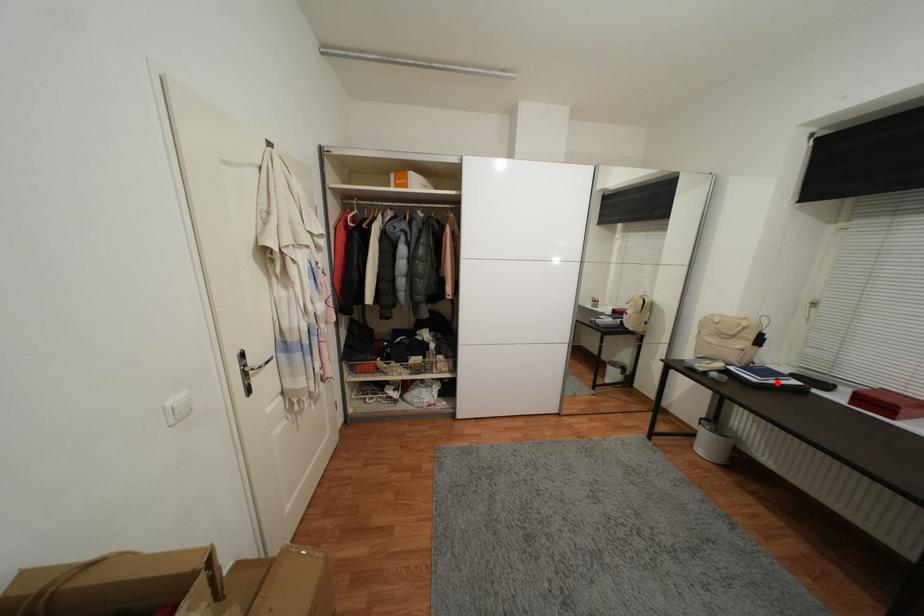
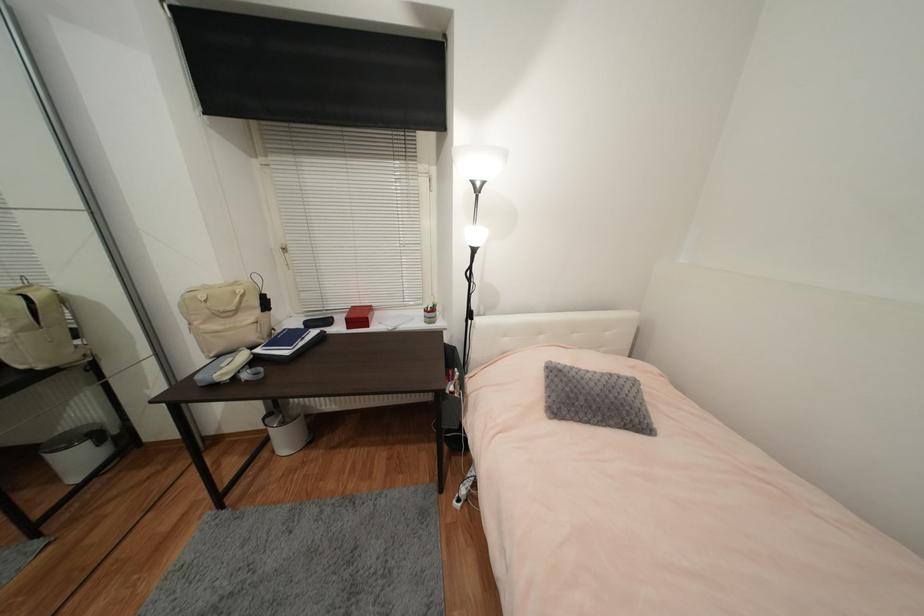
The point at the highlighted location is marked in the first image. Where is the corresponding point in the second image?

(306, 344)